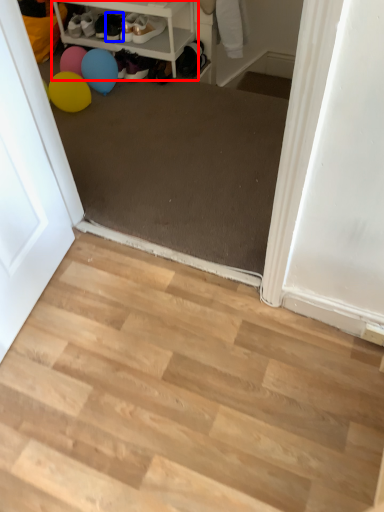
Question: Which object is closer to the camera taking this photo, shelf (highlighted by a red box) or footwear (highlighted by a blue box)?

Choices:
 (A) shelf
 (B) footwear

Answer: (A)